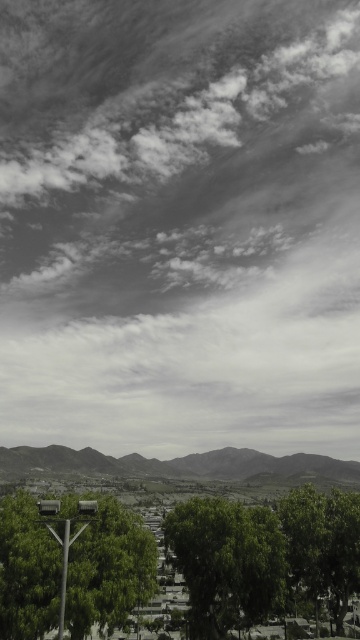
You are standing in the landscape scene and want to walk from the green leafy tree at lower left to the green leafy tree at center. Which direction should you head?

You should head to the right because the green leafy tree at lower left is to the left of the green leafy tree at center, so moving right will take you towards the center tree.

You are standing in the landscape scene and want to walk from the green leafy tree at center to the green leafy tree at lower right. Which direction should you head to get closer to the destination?

To get closer to the green leafy tree at lower right, you should head towards the lower right direction since the green leafy tree at lower right is larger than the green leafy tree at center, indicating it is closer to the foreground and thus positioned lower right in the scene.